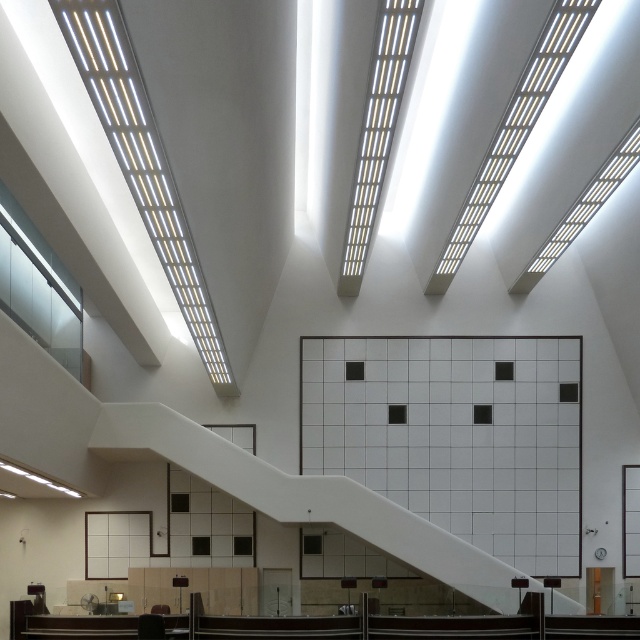
You are standing in the modern, minimalist building described. You need to locate the white tile wall at center. According to the coordinates provided, where would you find it?

The white tile wall at center is located at point coordinates of (456, 435).

You are an interior designer assessing the space. You need to place a large sculpture that requires a minimum of 3 meters of space. Given the white tile wall at center and the white glossy staircase at center, which object would you choose to place it near?

The white glossy staircase at center is larger than the white tile wall at center, so the sculpture should be placed near the white glossy staircase at center to accommodate the required space.